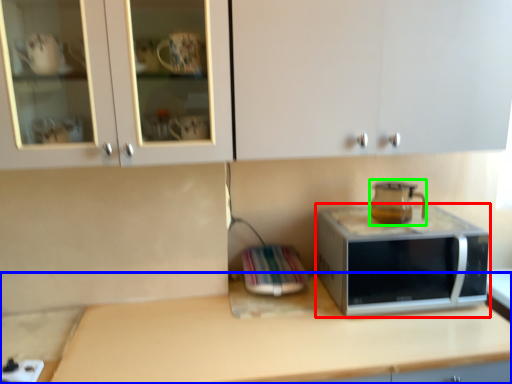
Question: Based on their relative distances, which object is farther from microwave oven (highlighted by a red box)? Choose from countertop (highlighted by a blue box) and coffeepot (highlighted by a green box).

Choices:
 (A) countertop
 (B) coffeepot

Answer: (A)